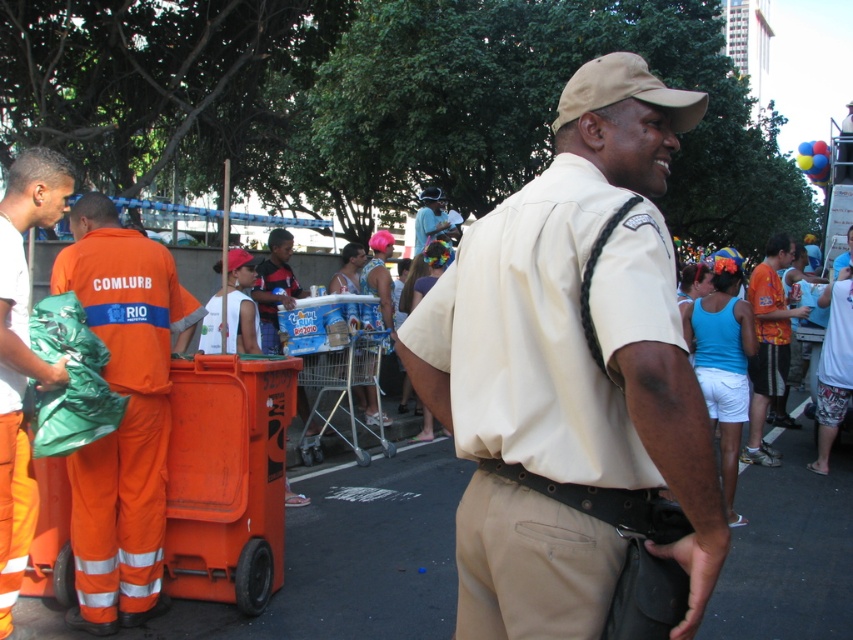
Does orange reflective jumpsuit at left have a smaller size compared to matte blue helmet at center?

Yes.

Between orange reflective jumpsuit at left and matte blue helmet at center, which one appears on the right side from the viewer's perspective?

Positioned to the right is matte blue helmet at center.

Is point (122, 284) positioned before point (431, 196)?

Yes, it is.

I want to click on orange reflective jumpsuit at left, so click(120, 419).

Which is below, beige uniform at center or white matte shirt at left?

white matte shirt at left is below.

Can you confirm if beige uniform at center is positioned below white matte shirt at left?

No.

Is point (660, 372) in front of point (16, 515)?

Yes, point (660, 372) is in front of point (16, 515).

This screenshot has width=853, height=640. Identify the location of beige uniform at center. (579, 321).

Describe the element at coordinates (579, 321) in the screenshot. I see `beige uniform at center` at that location.

Who is taller, beige uniform at center or orange jersey at center?

beige uniform at center is taller.

Describe the element at coordinates (579, 321) in the screenshot. I see `beige uniform at center` at that location.

You are a GUI agent. You are given a task and a screenshot of the screen. Output one action in this format:
    pyautogui.click(x=<x>, y=<y>)
    Task: Click on the beige uniform at center
    
    Given the screenshot: What is the action you would take?
    pyautogui.click(x=579, y=321)